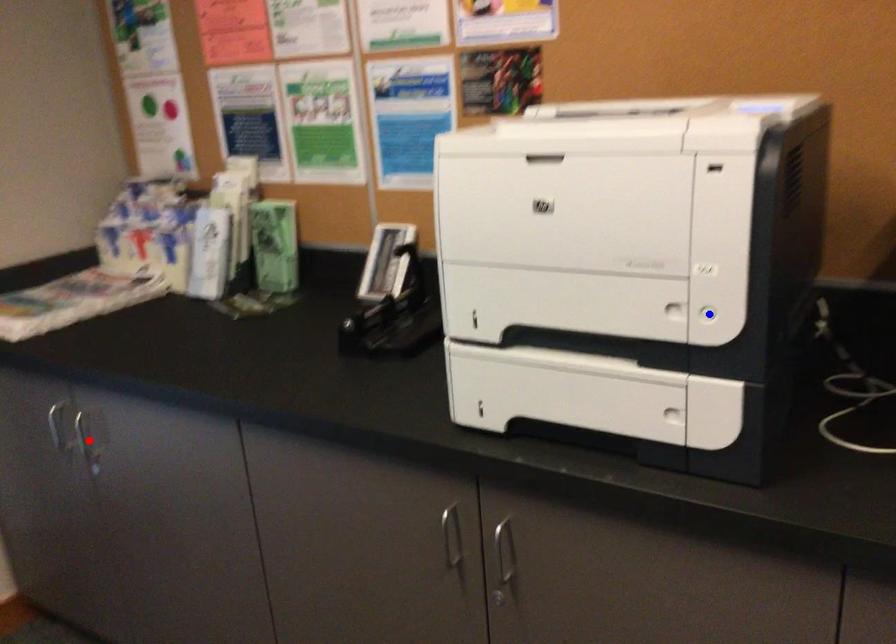
Question: Which of the two points in the image is closer to the camera?

Choices:
 (A) Blue point is closer.
 (B) Red point is closer.

Answer: (A)